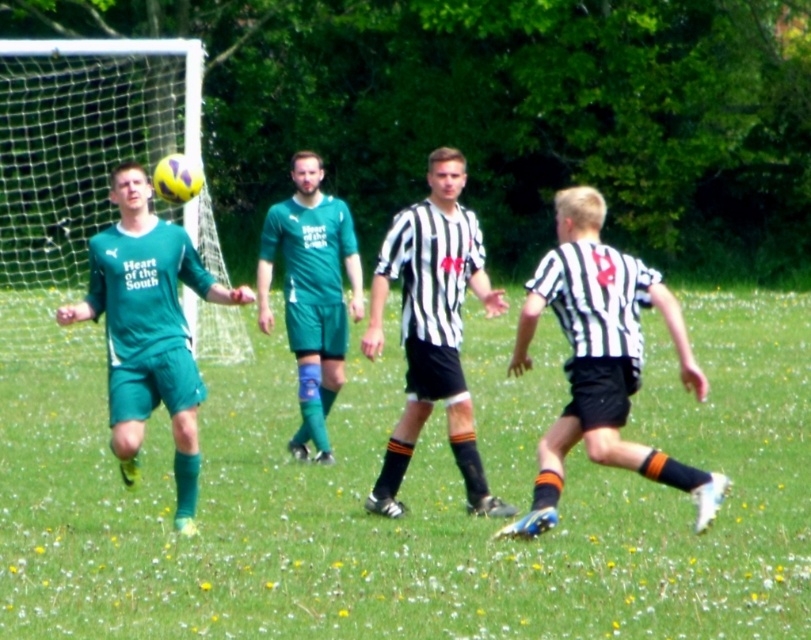
In the scene shown: You are a soccer player positioned at the point closer to the goal net. You see two points on the field marked as point [545,518] and point [471,234]. Which point is closer to you?

Point [545,518] is closer to the viewer than point [471,234], so the point closer to you is point [545,518].